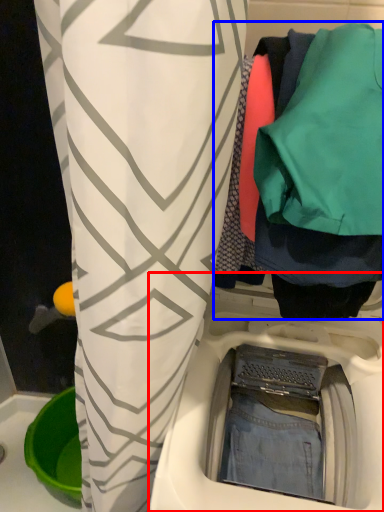
Question: Which object appears closest to the camera in this image, washing machine (highlighted by a red box) or closet (highlighted by a blue box)?

Choices:
 (A) washing machine
 (B) closet

Answer: (B)